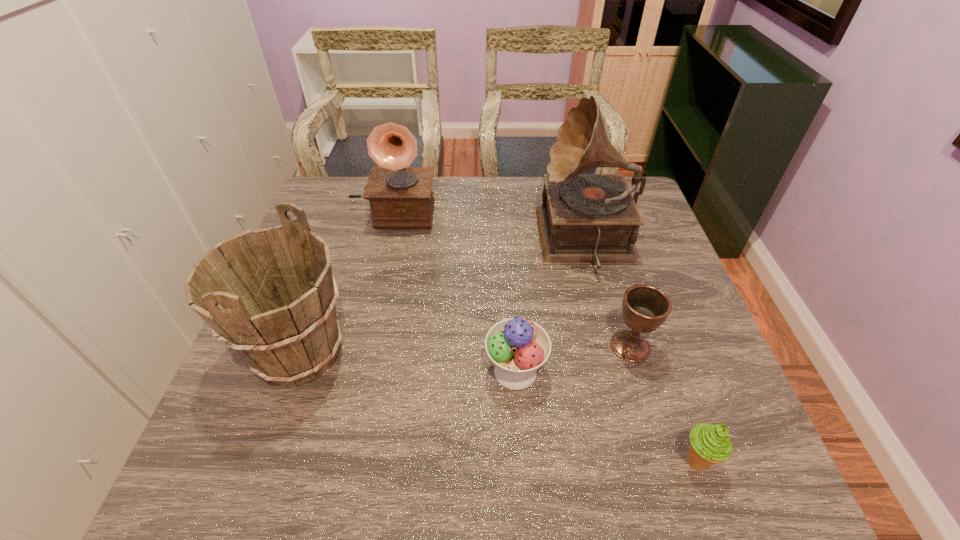
You are a GUI agent. You are given a task and a screenshot of the screen. Output one action in this format:
    pyautogui.click(x=<x>, y=<y>)
    Task: Click on the vacant space at the far left corner of the desktop
    This screenshot has height=540, width=960.
    Given the screenshot: What is the action you would take?
    pyautogui.click(x=352, y=187)

Find the location of a particular element. The width and height of the screenshot is (960, 540). free space between the left record player and the bucket is located at coordinates (348, 282).

You are a GUI agent. You are given a task and a screenshot of the screen. Output one action in this format:
    pyautogui.click(x=<x>, y=<y>)
    Task: Click on the free space that is in between the chalice and the right record player
    The width and height of the screenshot is (960, 540).
    Given the screenshot: What is the action you would take?
    pyautogui.click(x=608, y=294)

The image size is (960, 540). I want to click on vacant space that's between the bucket and the tallest object, so (x=444, y=297).

The width and height of the screenshot is (960, 540). What are the coordinates of `free space that is in between the right record player and the farther icecream` in the screenshot? It's located at [x=551, y=306].

Where is `free area in between the chalice and the bucket`? The width and height of the screenshot is (960, 540). free area in between the chalice and the bucket is located at coordinates (466, 350).

This screenshot has height=540, width=960. Find the location of `vacant area that lies between the left record player and the right record player`. vacant area that lies between the left record player and the right record player is located at coordinates (490, 226).

This screenshot has height=540, width=960. Identify the location of free space that is in between the tallest object and the left icecream. (551, 306).

Locate an element on the screen. blank region between the tallest object and the shorter record player is located at coordinates (490, 226).

Where is `object that is the fourth closest to the shorter record player`? object that is the fourth closest to the shorter record player is located at coordinates (644, 307).